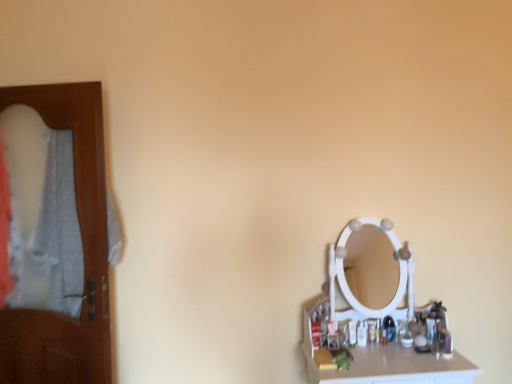
I want to click on vacant region to the right of translucent plastic bottle at right, so click(x=385, y=350).